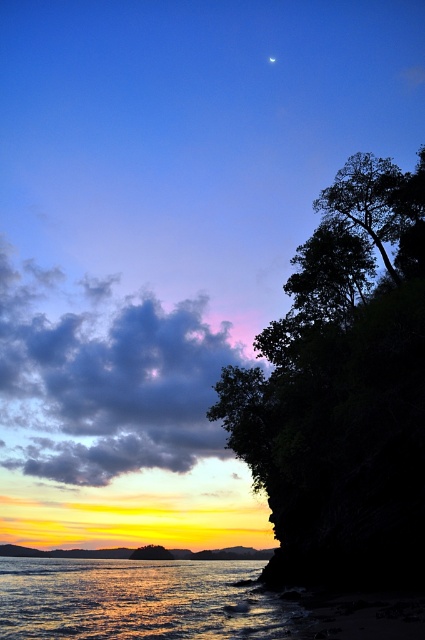
Does dark green leafy tree at right have a greater width compared to silvery reflective moon at upper center?

Indeed, dark green leafy tree at right has a greater width compared to silvery reflective moon at upper center.

Can you confirm if dark green leafy tree at right is bigger than silvery reflective moon at upper center?

Correct, dark green leafy tree at right is larger in size than silvery reflective moon at upper center.

Does point (283, 499) come closer to viewer compared to point (274, 58)?

Yes, it is in front of point (274, 58).

At what (x,y) coordinates should I click in order to perform the action: click on dark green leafy tree at right. Please return your answer as a coordinate pair (x, y). Looking at the image, I should click on (342, 392).

Does dark green leafy tree at right have a greater height compared to green leafy tree at lower center?

Indeed, dark green leafy tree at right has a greater height compared to green leafy tree at lower center.

Is dark green leafy tree at right positioned before green leafy tree at lower center?

Yes, it is in front of green leafy tree at lower center.

Which is behind, point (410, 348) or point (136, 552)?

Point (136, 552)

Find the location of a particular element. dark green leafy tree at right is located at coordinates (342, 392).

Can you confirm if shiny reflective water at lower left is positioned below silvery reflective moon at upper center?

Correct, shiny reflective water at lower left is located below silvery reflective moon at upper center.

This screenshot has height=640, width=425. What do you see at coordinates (136, 600) in the screenshot?
I see `shiny reflective water at lower left` at bounding box center [136, 600].

Who is more forward, (5, 586) or (274, 58)?

Positioned in front is point (5, 586).

Find the location of a particular element. shiny reflective water at lower left is located at coordinates [x=136, y=600].